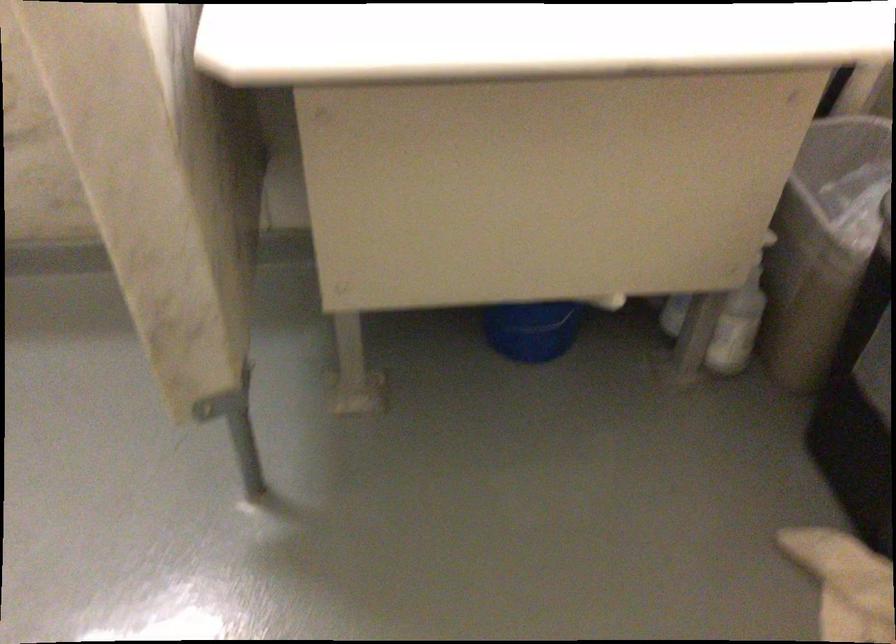
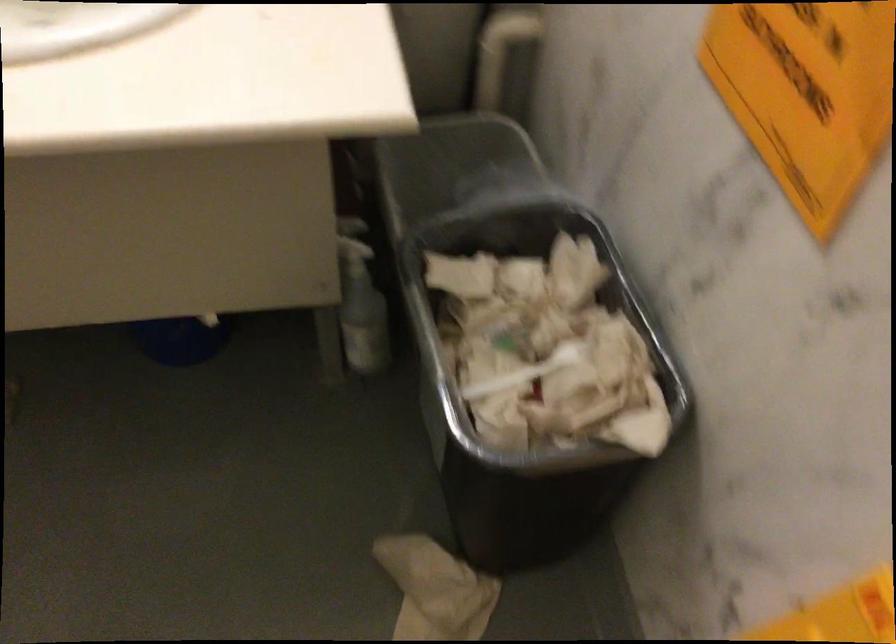
Question: Based on the continuous images, in which direction is the camera rotating? Reply with the corresponding letter.

Choices:
 (A) Left
 (B) Right
 (C) Up
 (D) Down

Answer: (D)